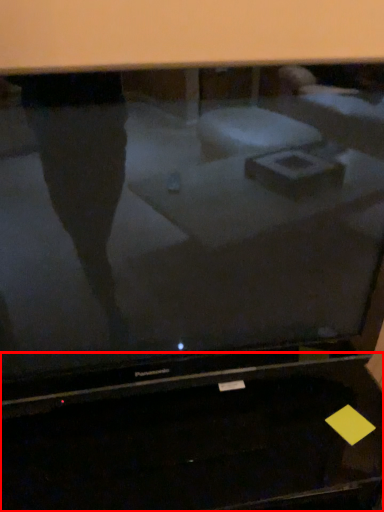
Question: From the image's perspective, what is the correct spatial positioning of desktop (annotated by the red box) in reference to television?

Choices:
 (A) above
 (B) below

Answer: (B)